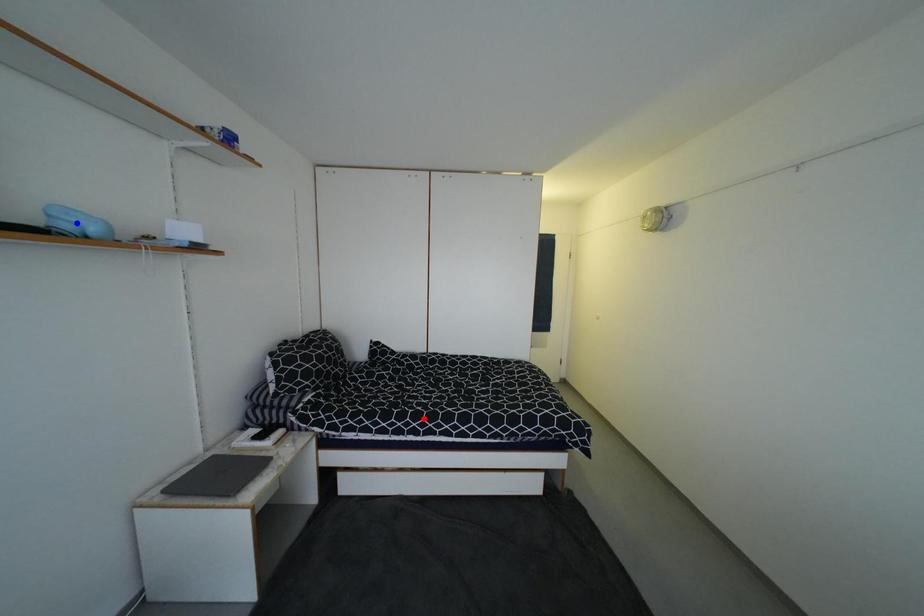
Question: Two points are marked on the image. Which point is closer to the camera?

Choices:
 (A) Blue point is closer.
 (B) Red point is closer.

Answer: (A)